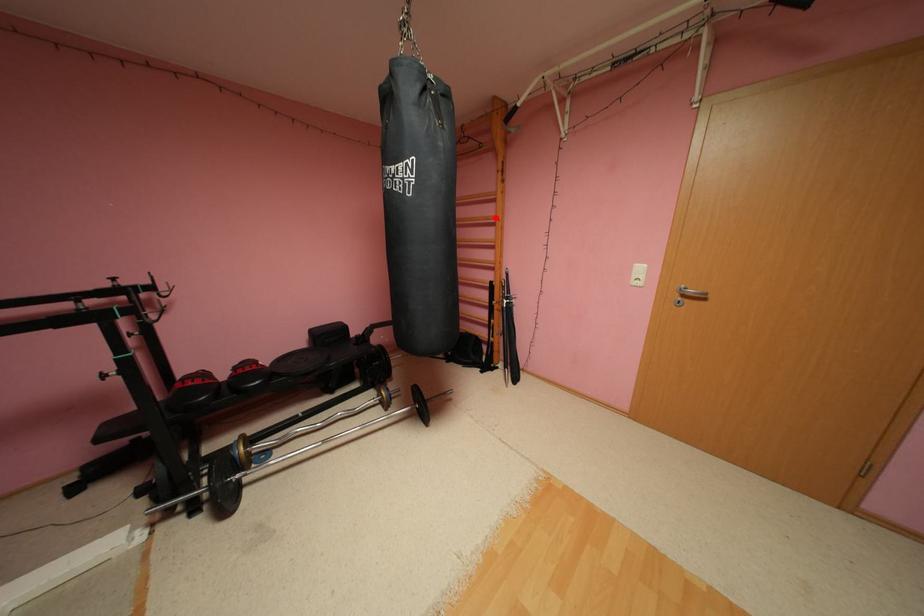
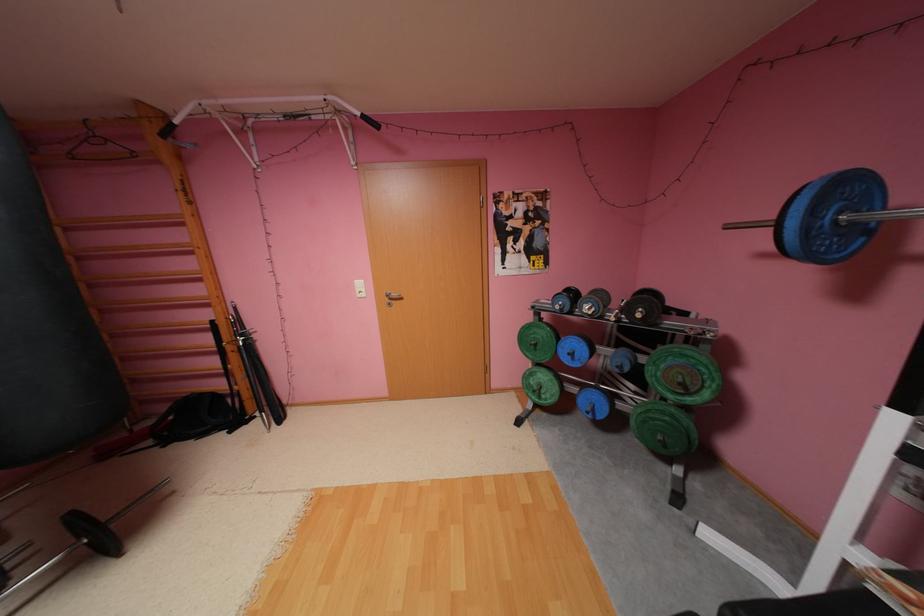
The point at the highlighted location is marked in the first image. Where is the corresponding point in the second image?

(187, 245)